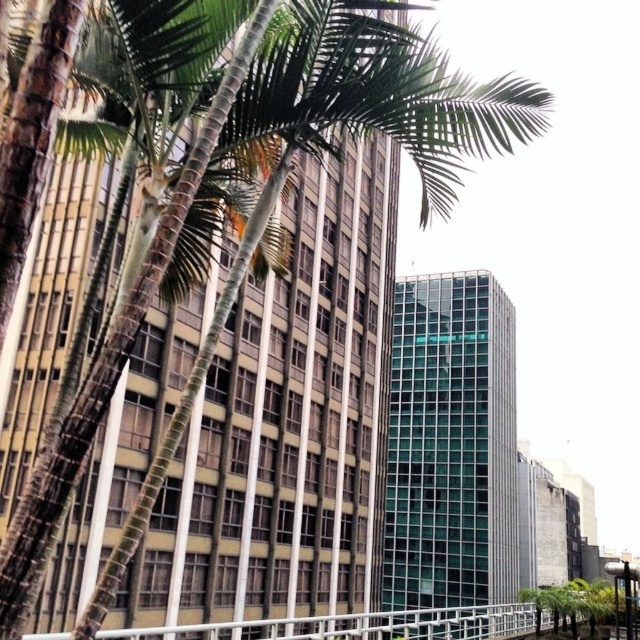
You are standing in the urban scene described and want to walk from the point at coordinates point (212, 632) to the point at coordinates point (625, 566). Will you pass in front of or behind the palm trees during your journey?

Since point (212, 632) is in front of point (625, 566), you will be moving towards the background of the image. The palm trees are in the foreground, so you would pass behind them as you move from point (212, 632) to point (625, 566).